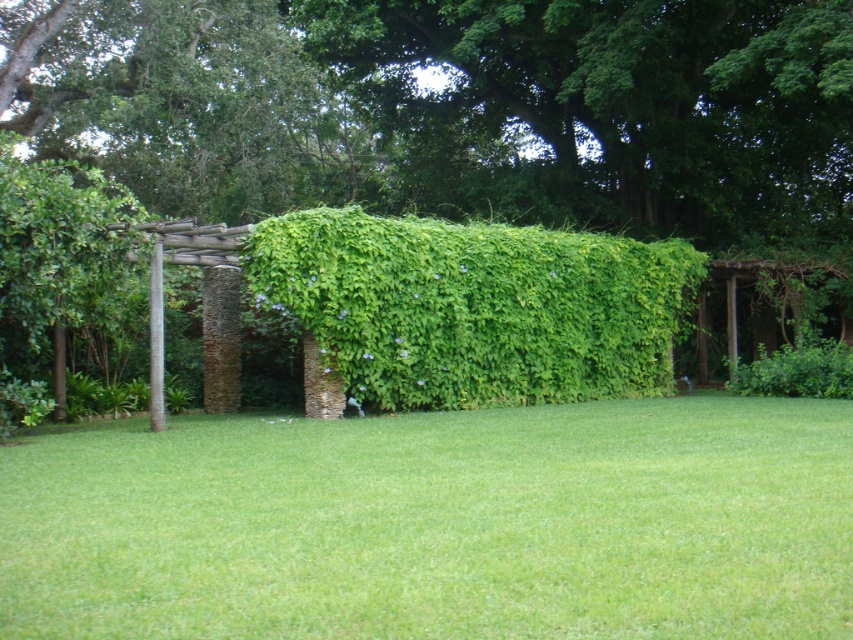
Question: Is green grass at center wider than green leafy hedge at center?

Choices:
 (A) yes
 (B) no

Answer: (A)

Question: Which of the following is the closest to the observer?

Choices:
 (A) (538, 596)
 (B) (383, 241)

Answer: (A)

Question: Which point appears farthest from the camera in this image?

Choices:
 (A) (496, 528)
 (B) (384, 220)

Answer: (B)

Question: Does green grass at center lie behind green leafy hedge at center?

Choices:
 (A) yes
 (B) no

Answer: (B)

Question: Is green grass at center bigger than green leafy hedge at center?

Choices:
 (A) yes
 (B) no

Answer: (B)